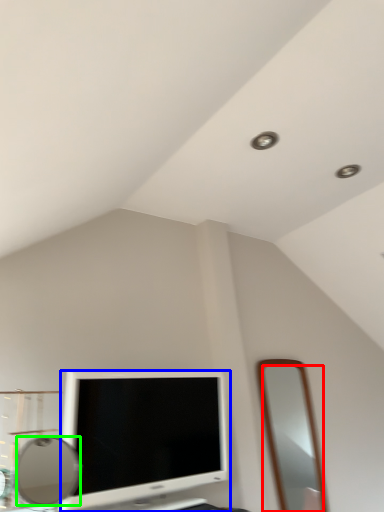
Question: Based on their relative distances, which object is nearer to mirror (highlighted by a red box)? Choose from television (highlighted by a blue box) and mirror (highlighted by a green box).

Choices:
 (A) television
 (B) mirror

Answer: (B)